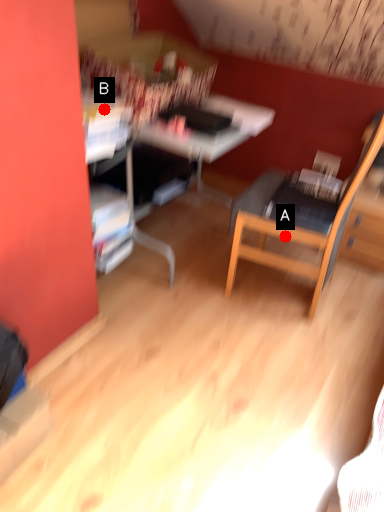
Question: Two points are circled on the image, labeled by A and B beside each circle. Which point is closer to the camera?

Choices:
 (A) A is closer
 (B) B is closer

Answer: (B)